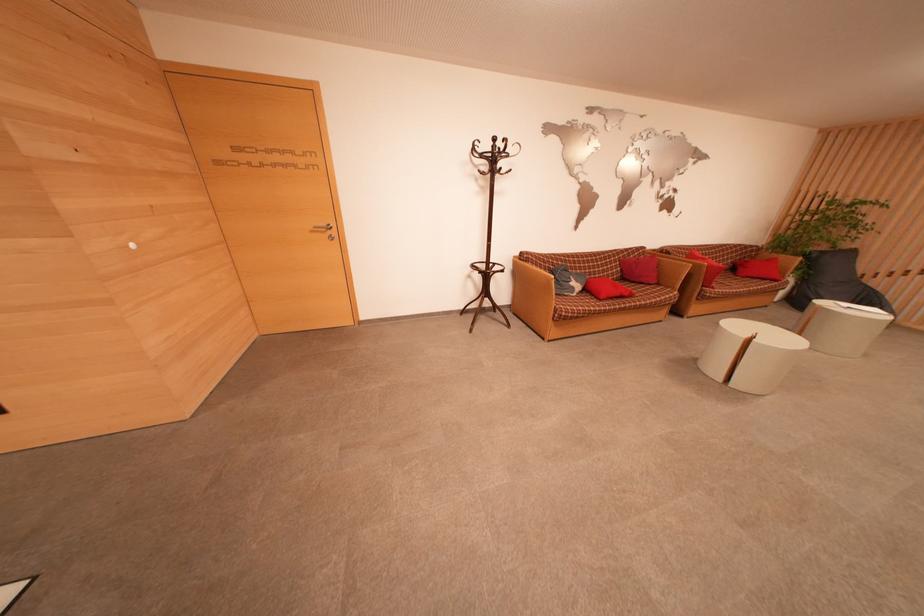
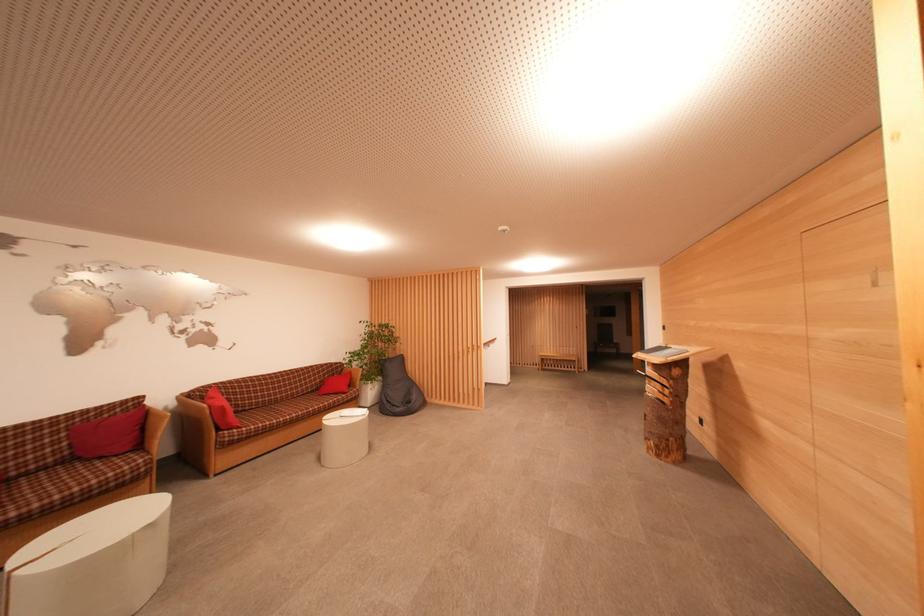
Question: I am providing you with two images of the same scene from different viewpoints. Please identify which objects are invisible in image2.

Choices:
 (A) red pillow
 (B) sofa sitting surface
 (C) grey beanbag
 (D) none of these

Answer: (D)